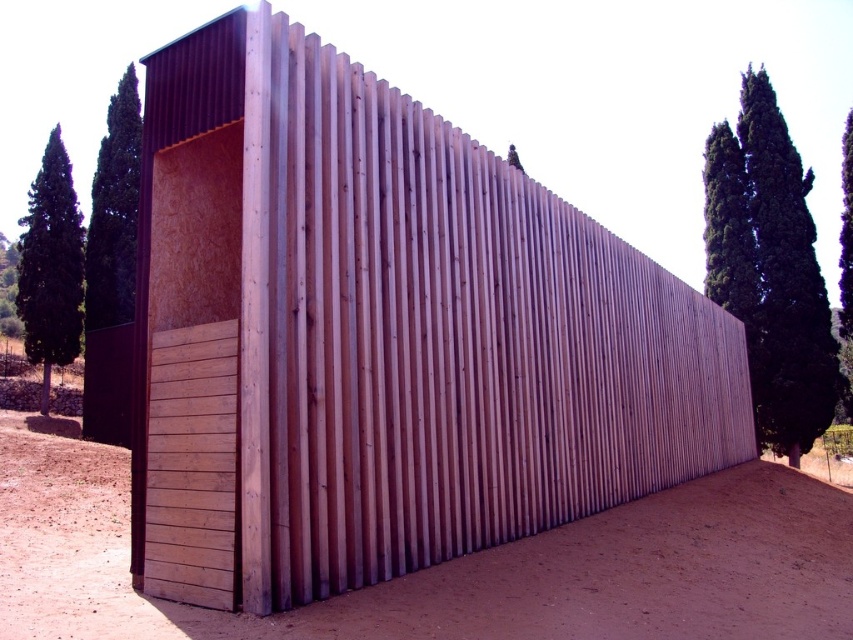
Is the position of wooden fence at center more distant than that of green textured cypress tree at left?

No.

Consider the image. Does wooden fence at center have a greater width compared to green textured cypress tree at left?

Yes.

Who is more forward, [202,477] or [85,314]?

Positioned in front is point [202,477].

Image resolution: width=853 pixels, height=640 pixels. Find the location of `wooden fence at center`. wooden fence at center is located at coordinates (381, 337).

Who is taller, brown sandy dirt at lower center or green leafy cypress at left?

With more height is green leafy cypress at left.

Does point (96, 609) come closer to viewer compared to point (82, 310)?

Yes, it is.

You are a GUI agent. You are given a task and a screenshot of the screen. Output one action in this format:
    pyautogui.click(x=<x>, y=<y>)
    Task: Click on the brown sandy dirt at lower center
    Image resolution: width=853 pixels, height=640 pixels.
    Given the screenshot: What is the action you would take?
    pyautogui.click(x=451, y=564)

The height and width of the screenshot is (640, 853). I want to click on brown sandy dirt at lower center, so click(451, 564).

Between green leafy cypress at upper right and green textured cypress tree at left, which one is positioned lower?

green leafy cypress at upper right

What do you see at coordinates (770, 269) in the screenshot?
I see `green leafy cypress at upper right` at bounding box center [770, 269].

Identify the location of green leafy cypress at upper right. (770, 269).